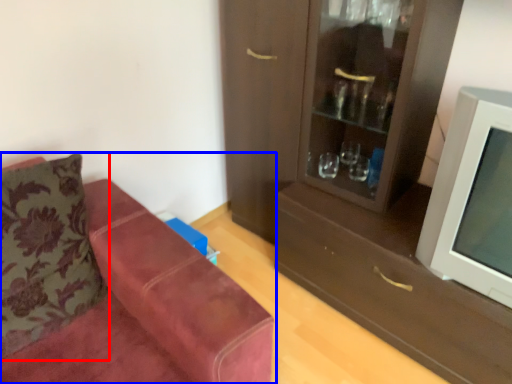
Question: Which point is further to the camera, pillow (highlighted by a red box) or studio couch (highlighted by a blue box)?

Choices:
 (A) pillow
 (B) studio couch

Answer: (A)